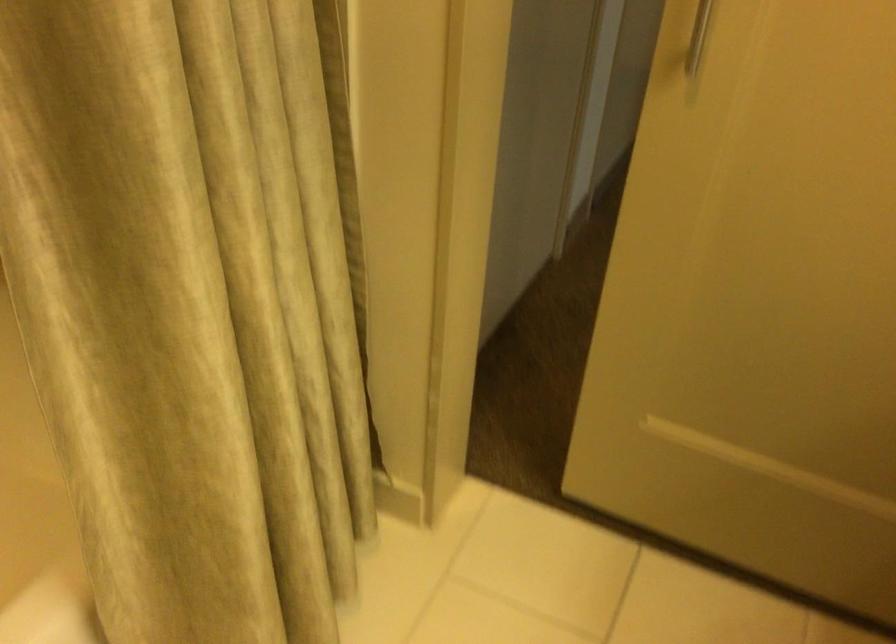
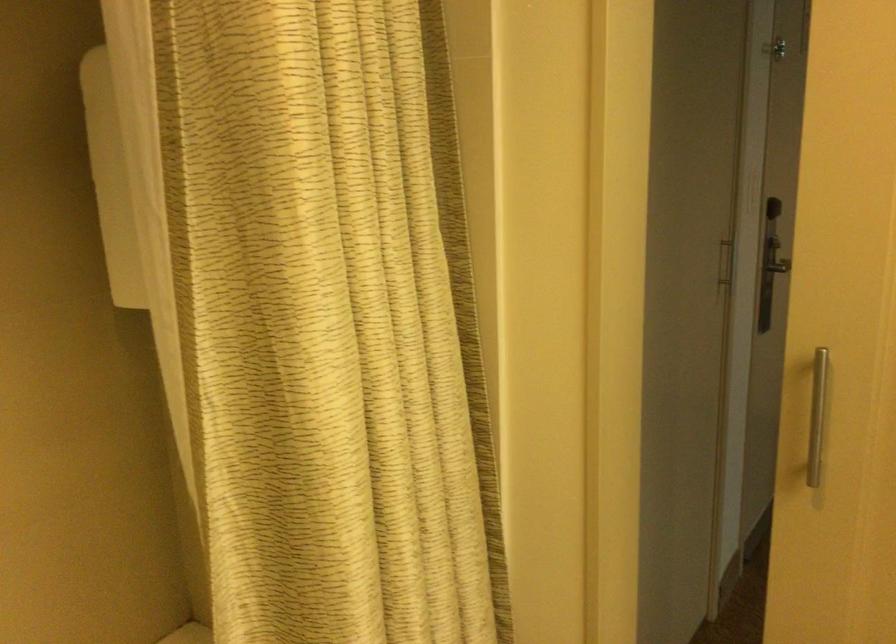
Question: The images are taken continuously from a first-person perspective. In which direction is your viewpoint rotating?

Choices:
 (A) Left
 (B) Right
 (C) Up
 (D) Down

Answer: (C)